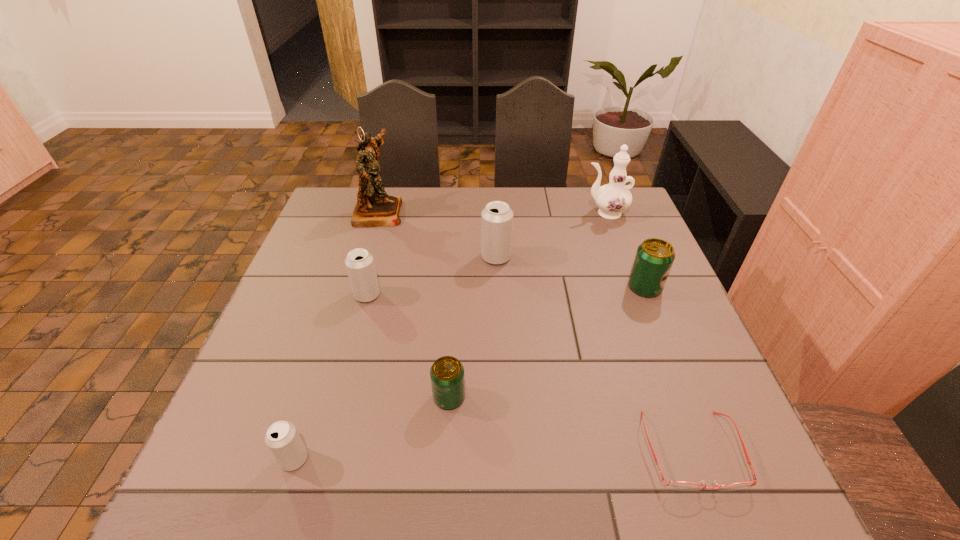
The height and width of the screenshot is (540, 960). Identify the location of beer can located at the right edge. (654, 258).

Identify the location of spectacles that is at the right edge. (676, 485).

Find the location of a particular element. The image size is (960, 540). object located at the far left corner is located at coordinates (374, 208).

Image resolution: width=960 pixels, height=540 pixels. Identify the location of object present at the near left corner. (282, 438).

Where is `object that is positioned at the far right corner`? object that is positioned at the far right corner is located at coordinates pyautogui.click(x=613, y=198).

This screenshot has width=960, height=540. In order to click on object that is at the near right corner in this screenshot , I will do `click(676, 485)`.

Image resolution: width=960 pixels, height=540 pixels. What are the coordinates of `blank space at the far edge of the desktop` in the screenshot? It's located at (571, 221).

The height and width of the screenshot is (540, 960). What are the coordinates of `free space at the near edge` in the screenshot? It's located at (309, 481).

At what (x,y) coordinates should I click in order to perform the action: click on free space at the left edge. Please return your answer as a coordinate pair (x, y). This screenshot has width=960, height=540. Looking at the image, I should click on (211, 448).

At what (x,y) coordinates should I click in order to perform the action: click on vacant space at the right edge of the desktop. Please return your answer as a coordinate pair (x, y). Looking at the image, I should click on (672, 295).